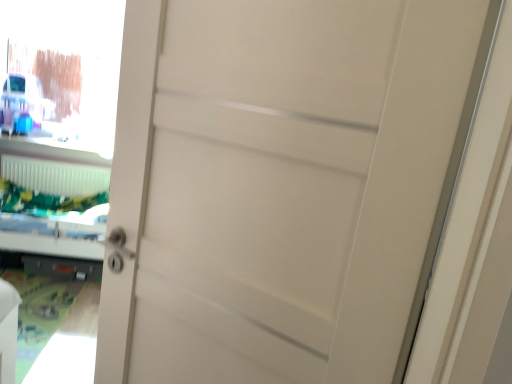
Find the location of a particular element. The image size is (512, 384). transparent glass window screen at upper left is located at coordinates (66, 66).

From the image's perspective, is white plastic radiator at lower left under transparent glass window screen at upper left?

Correct, white plastic radiator at lower left appears lower than transparent glass window screen at upper left in the image.

From the picture: Is there a large distance between white plastic radiator at lower left and transparent glass window screen at upper left?

That's not correct — white plastic radiator at lower left is a little close to transparent glass window screen at upper left.

Is transparent glass window screen at upper left at the back of white plastic radiator at lower left?

No, white plastic radiator at lower left is not facing the opposite direction of transparent glass window screen at upper left.

Considering the sizes of objects white plastic radiator at lower left and transparent glass window screen at upper left in the image provided, who is wider, white plastic radiator at lower left or transparent glass window screen at upper left?

white plastic radiator at lower left.

Which is behind, point (77, 191) or point (35, 206)?

The point (77, 191) is behind.

Image resolution: width=512 pixels, height=384 pixels. I want to click on radiator above the green fabric bed at left (from a real-world perspective), so click(55, 176).

How many degrees apart are the facing directions of white plastic radiator at lower left and green fabric bed at left?

The angle between the facing direction of white plastic radiator at lower left and the facing direction of green fabric bed at left is 90 degrees.

Is white plastic radiator at lower left in front of green fabric bed at left?

No, it is not.

Is transparent glass window screen at upper left wider than green fabric bed at left?

Incorrect, the width of transparent glass window screen at upper left does not surpass that of green fabric bed at left.

Is point (48, 8) farther from camera compared to point (56, 242)?

Yes, it is.

From their relative heights in the image, would you say transparent glass window screen at upper left is taller or shorter than green fabric bed at left?

transparent glass window screen at upper left is taller than green fabric bed at left.

Based on the photo, would you say transparent glass window screen at upper left is a long distance from green fabric bed at left?

No, transparent glass window screen at upper left is not far away from green fabric bed at left.

Locate an element on the screen. The height and width of the screenshot is (384, 512). radiator that is above the green fabric bed at left (from a real-world perspective) is located at coordinates (55, 176).

Is green fabric bed at left shorter than white plastic radiator at lower left?

Incorrect, the height of green fabric bed at left does not fall short of that of white plastic radiator at lower left.

From the image's perspective, is green fabric bed at left located above white plastic radiator at lower left?

No, from the image's perspective, green fabric bed at left is not over white plastic radiator at lower left.

Is transparent glass window screen at upper left shorter than white plastic radiator at lower left?

No.

Looking at their sizes, would you say transparent glass window screen at upper left is wider or thinner than white plastic radiator at lower left?

Considering their sizes, transparent glass window screen at upper left looks slimmer than white plastic radiator at lower left.

Considering the positions of objects transparent glass window screen at upper left and white plastic radiator at lower left in the image provided, who is more to the right, transparent glass window screen at upper left or white plastic radiator at lower left?

Positioned to the right is transparent glass window screen at upper left.

Is transparent glass window screen at upper left turned away from white plastic radiator at lower left?

No, transparent glass window screen at upper left's orientation is not away from white plastic radiator at lower left.

Do you think green fabric bed at left is within transparent glass window screen at upper left, or outside of it?

green fabric bed at left is located beyond the bounds of transparent glass window screen at upper left.

Is green fabric bed at left taller than transparent glass window screen at upper left?

Incorrect, the height of green fabric bed at left is not larger of that of transparent glass window screen at upper left.

Would you say green fabric bed at left is to the left or to the right of transparent glass window screen at upper left in the picture?

Based on their positions, green fabric bed at left is located to the right of transparent glass window screen at upper left.

At what (x,y) coordinates should I click in order to perform the action: click on radiator located behind the transparent glass window screen at upper left. Please return your answer as a coordinate pair (x, y). The height and width of the screenshot is (384, 512). Looking at the image, I should click on tap(55, 176).

Where is `bed that is below the white plastic radiator at lower left (from the image's perspective)`? bed that is below the white plastic radiator at lower left (from the image's perspective) is located at coordinates (54, 207).

Looking at the image, which one is located closer to green fabric bed at left, transparent glass window screen at upper left or white plastic radiator at lower left?

white plastic radiator at lower left.

When comparing their distances from white plastic radiator at lower left, does transparent glass window screen at upper left or green fabric bed at left seem closer?

green fabric bed at left.

From the picture: From the image, which object appears to be farther from green fabric bed at left, white plastic radiator at lower left or transparent glass window screen at upper left?

transparent glass window screen at upper left is positioned further to the anchor green fabric bed at left.

From the picture: Looking at the image, which one is located further to transparent glass window screen at upper left, green fabric bed at left or white plastic radiator at lower left?

green fabric bed at left is further to transparent glass window screen at upper left.

Looking at the image, which one is located further to transparent glass window screen at upper left, white plastic radiator at lower left or green fabric bed at left?

green fabric bed at left.

Estimate the real-world distances between objects in this image. Which object is further from white plastic radiator at lower left, green fabric bed at left or transparent glass window screen at upper left?

transparent glass window screen at upper left lies further to white plastic radiator at lower left than the other object.

Find the location of a particular element. radiator between transparent glass window screen at upper left and green fabric bed at left in the vertical direction is located at coordinates (55, 176).